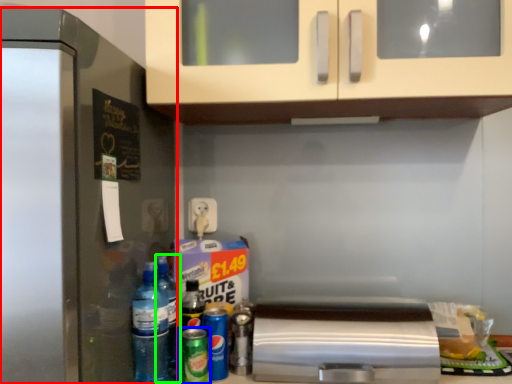
Question: Which is farther away from refrigerator (highlighted by a red box)? beer (highlighted by a blue box) or bottle (highlighted by a green box)?

Choices:
 (A) beer
 (B) bottle

Answer: (A)